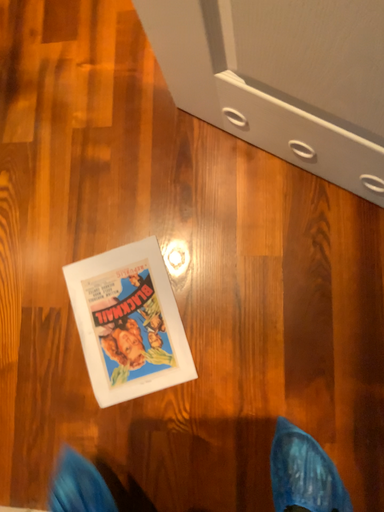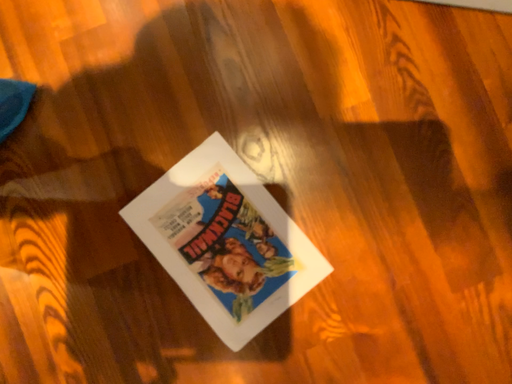
Question: How did the camera likely rotate when shooting the video?

Choices:
 (A) rotated left
 (B) rotated right

Answer: (B)